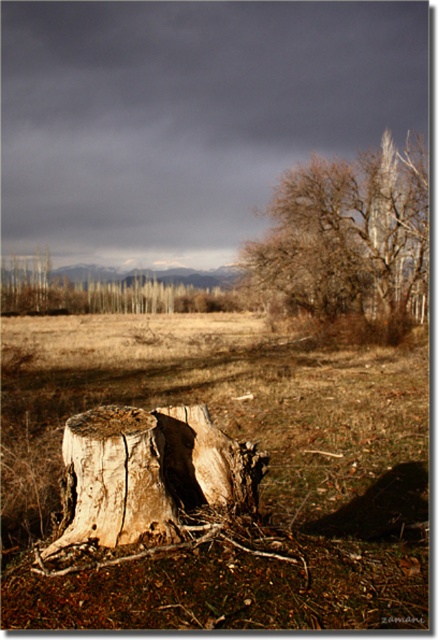
Question: Does brown rough bark tree at upper right appear on the left side of light brown wood stump at center?

Choices:
 (A) no
 (B) yes

Answer: (A)

Question: Can you confirm if brown rough bark tree at upper right is positioned to the left of light brown wood stump at center?

Choices:
 (A) yes
 (B) no

Answer: (B)

Question: Which point is closer to the camera?

Choices:
 (A) (170, 452)
 (B) (399, 488)

Answer: (A)

Question: Can you confirm if brown rough bark tree at upper right is positioned to the left of light brown wood stump at center?

Choices:
 (A) no
 (B) yes

Answer: (A)

Question: Based on their relative distances, which object is farther from the brown rough bark tree at upper right?

Choices:
 (A) brown wood stump at center
 (B) light brown wood stump at center

Answer: (B)

Question: Which of these objects is positioned farthest from the brown rough bark tree at upper right?

Choices:
 (A) light brown wood stump at center
 (B) brown wood stump at center

Answer: (A)